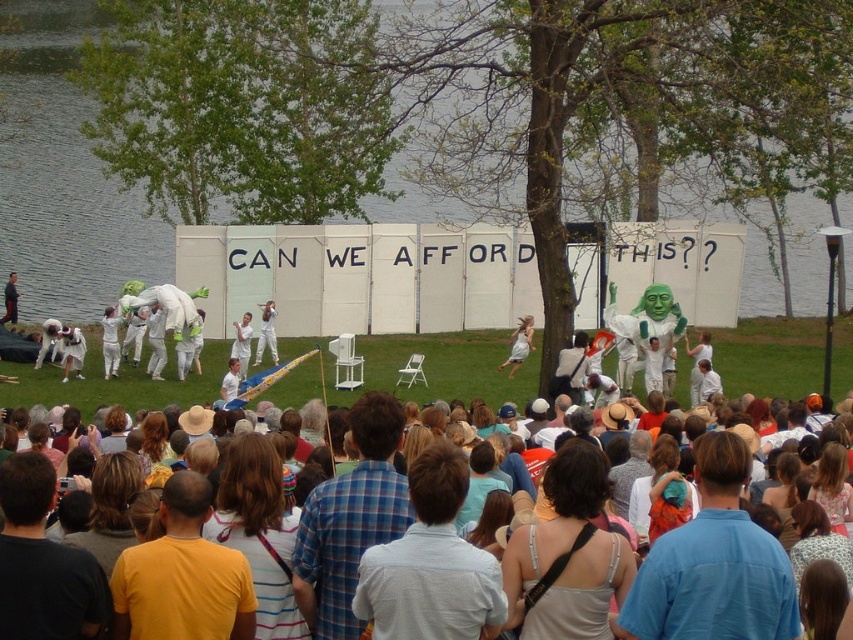
Who is higher up, yellow shirt at center or white cotton dress at center?

white cotton dress at center

Is point (239, 618) less distant than point (525, 348)?

Yes, it is.

Find the location of `yellow shirt at center`. yellow shirt at center is located at coordinates (183, 576).

Which is more to the right, blue cotton shirt at center or blue plaid shirt at center?

blue cotton shirt at center is more to the right.

Which is in front, point (741, 532) or point (392, 429)?

Point (741, 532) is more forward.

Does point (677, 637) come closer to viewer compared to point (393, 534)?

Yes, point (677, 637) is in front of point (393, 534).

The width and height of the screenshot is (853, 640). Identify the location of blue cotton shirt at center. (714, 564).

Can you confirm if striped cotton shirt at center is thinner than multicolored casual clothing at center?

Yes, striped cotton shirt at center is thinner than multicolored casual clothing at center.

Does striped cotton shirt at center appear under multicolored casual clothing at center?

Correct, striped cotton shirt at center is located below multicolored casual clothing at center.

Describe the element at coordinates (259, 531) in the screenshot. This screenshot has height=640, width=853. I see `striped cotton shirt at center` at that location.

Where is `striped cotton shirt at center`? The image size is (853, 640). striped cotton shirt at center is located at coordinates (259, 531).